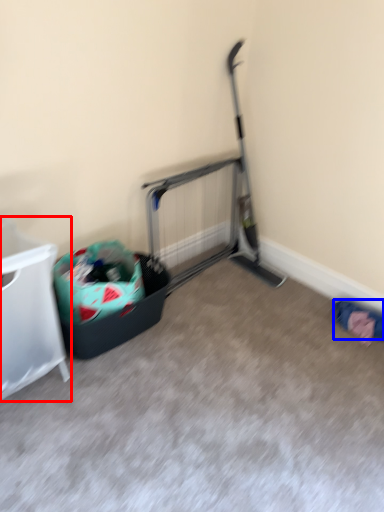
Question: Which point is further to the camera, furniture (highlighted by a red box) or clothing (highlighted by a blue box)?

Choices:
 (A) furniture
 (B) clothing

Answer: (B)